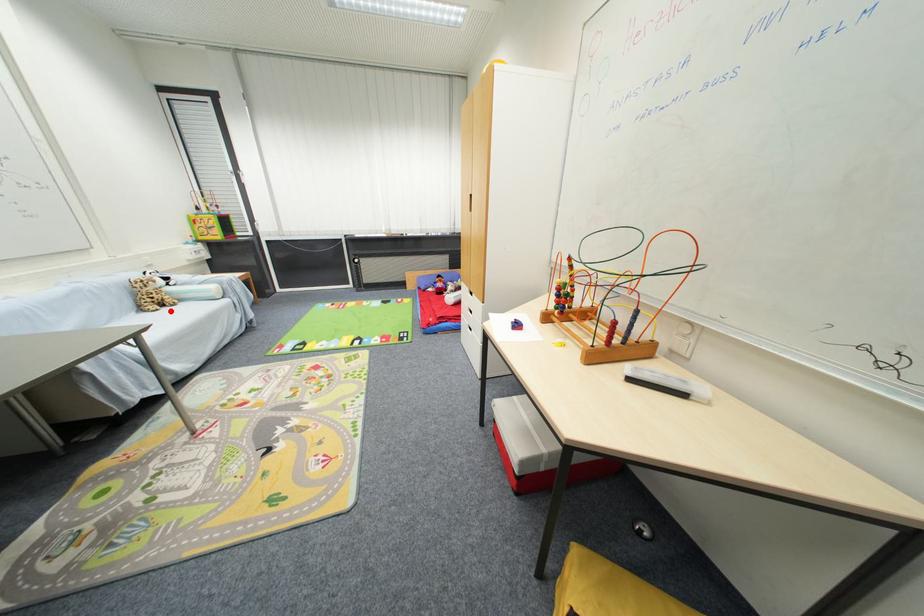
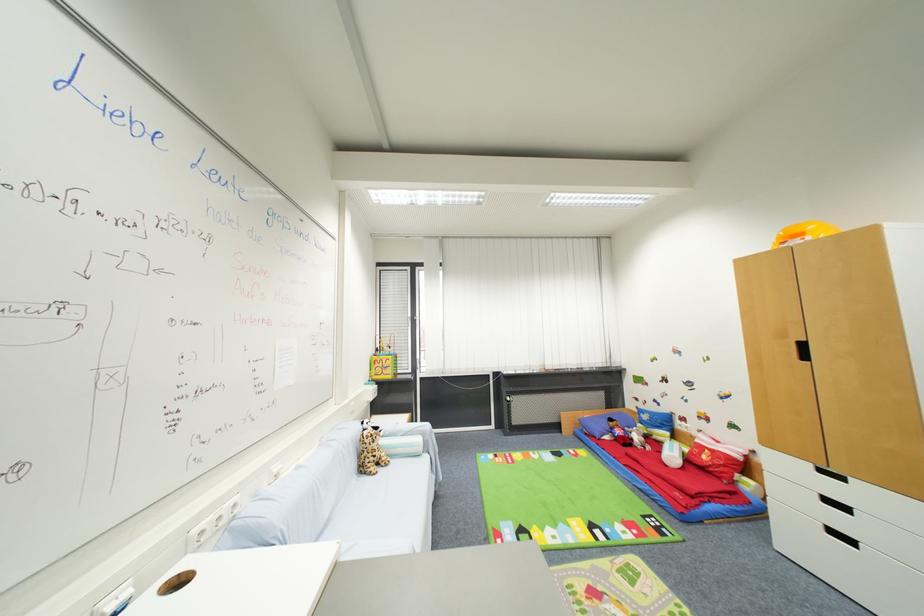
Question: I am providing you with two images of the same scene from different viewpoints. Given a red point in image1, look at the same physical point in image2. Is it:

Choices:
 (A) Closer to the viewpoint
 (B) Farther from the viewpoint

Answer: (B)